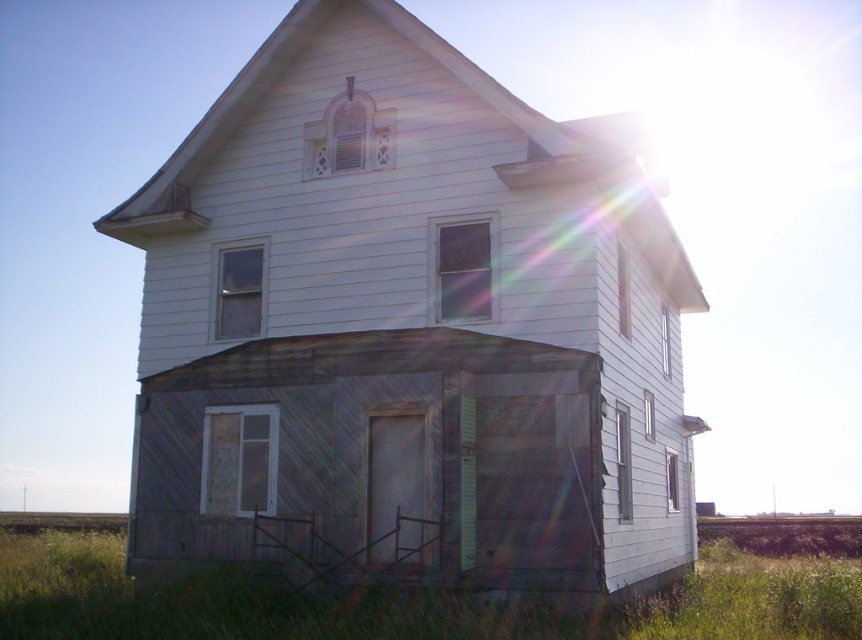
Does white wooden house at center appear over green grass at lower center?

Indeed, white wooden house at center is positioned over green grass at lower center.

Is white wooden house at center thinner than green grass at lower center?

Yes, white wooden house at center is thinner than green grass at lower center.

Image resolution: width=862 pixels, height=640 pixels. In order to click on white wooden house at center in this screenshot , I will do `click(407, 326)`.

Locate an element on the screen. The image size is (862, 640). white wooden house at center is located at coordinates (407, 326).